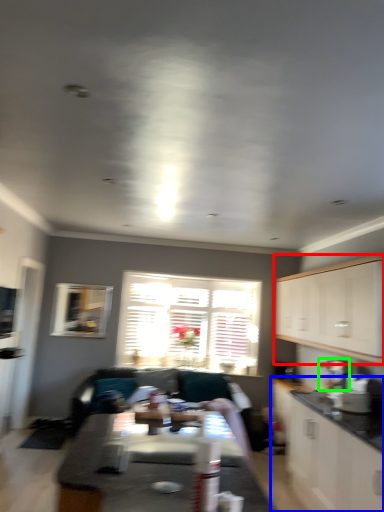
Question: Estimate the real-world distances between objects in this image. Which object is closer to cabinetry (highlighted by a red box), cabinetry (highlighted by a blue box) or appliance (highlighted by a green box)?

Choices:
 (A) cabinetry
 (B) appliance

Answer: (B)